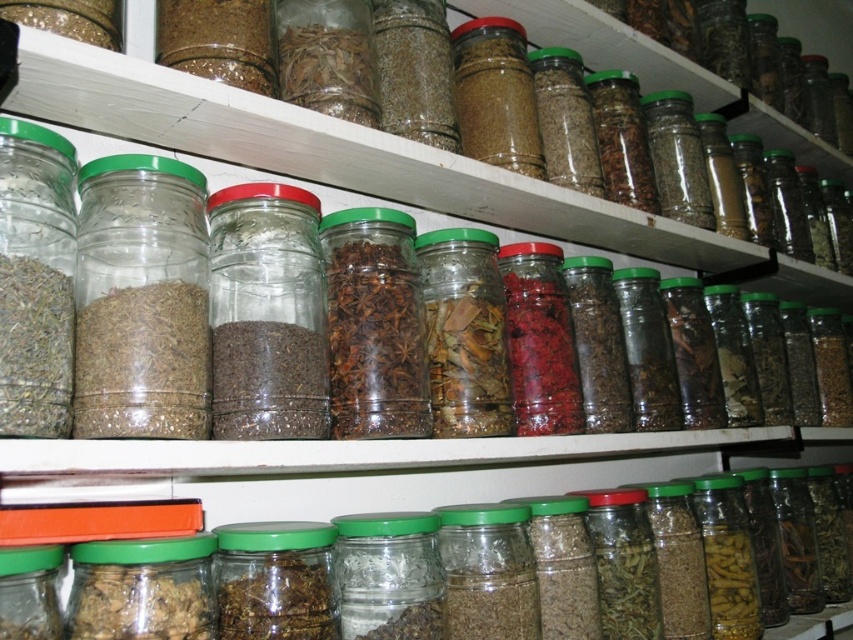
Question: Which object is positioned farthest from the green matte jar at center?

Choices:
 (A) green matte glass jar at center
 (B) translucent glass jar at left
 (C) brown matte jar at center
 (D) clear glass jars at center

Answer: (D)

Question: Which object is positioned farthest from the green matte glass jar at center?

Choices:
 (A) brown matte jar at center
 (B) green matte jar at lower left
 (C) green matte jar at center
 (D) translucent glass jar at left

Answer: (D)

Question: From the image, what is the correct spatial relationship of clear glass jars at center in relation to clear glass jar at left?

Choices:
 (A) left
 (B) right

Answer: (B)

Question: Can you confirm if green matte jar at center is bigger than green matte glass jar at center?

Choices:
 (A) yes
 (B) no

Answer: (A)

Question: Is clear glass jar at left smaller than green matte glass jar at center?

Choices:
 (A) yes
 (B) no

Answer: (B)

Question: Considering the real-world distances, which object is closest to the translucent glass jar at left?

Choices:
 (A) brown matte spice at center
 (B) green matte jar at center
 (C) green matte glass jar at center

Answer: (B)